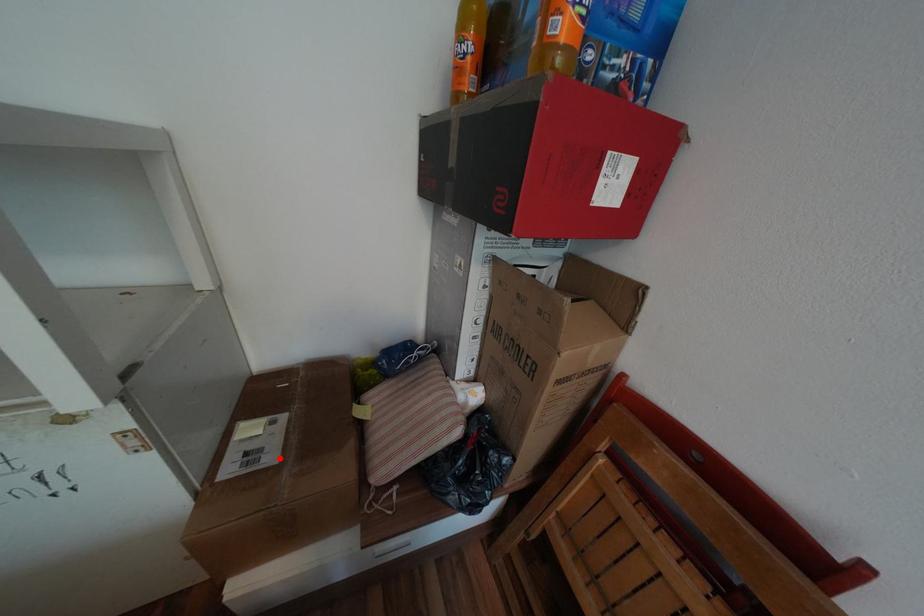
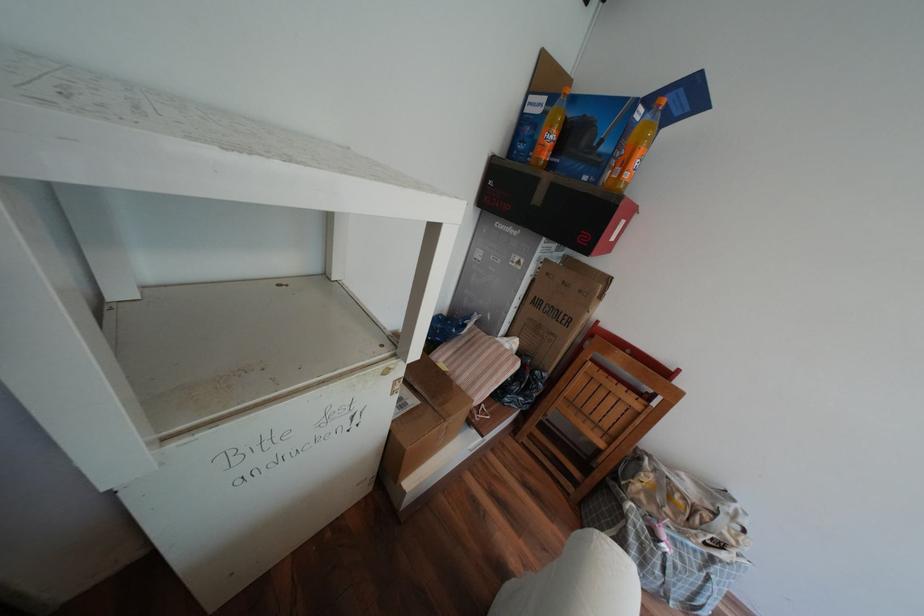
Question: A red point is marked in image1. In image2, is the corresponding 3D point closer to the camera or farther? Reply with the corresponding letter.

Choices:
 (A) The corresponding 3D point is closer.
 (B) The corresponding 3D point is farther.

Answer: (B)